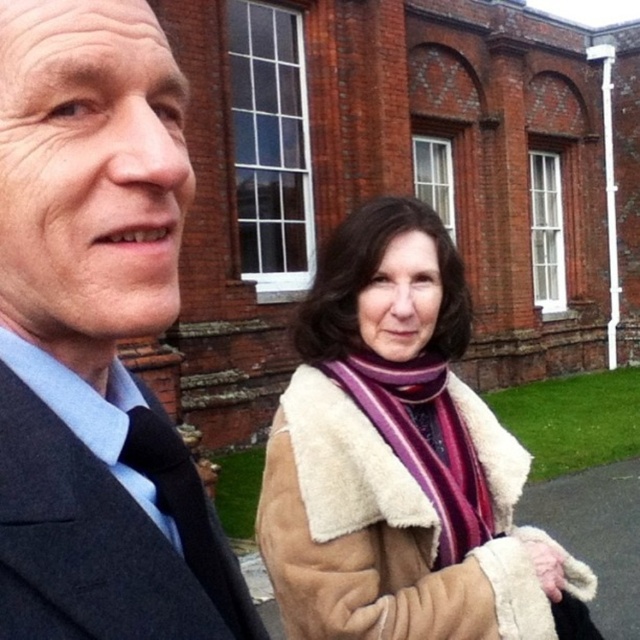
You are trying to determine which item is closer to the camera between the sheepskin coat at center and the purple striped scarf at center. Based on the scene, which one is closer?

The sheepskin coat at center is in front of the purple striped scarf at center, so it is closer to the camera.

You are a fashion designer observing the two outfits in the image. The dark blue woolen suit at left and the purple striped scarf at center. Which outfit is taller?

The dark blue woolen suit at left is taller than the purple striped scarf at center.

You are a photographer trying to capture a group photo of the dark gray suit at left and the sheepskin coat at center. The minimum distance your camera can focus on two subjects clearly is 5 meters. Can you take a photo of both subjects clearly from your current position?

The distance between the dark gray suit at left and the sheepskin coat at center is 5.51 meters, which exceeds the camera minimum focus distance of 5 meters. Therefore, you can take a photo of both subjects clearly from your current position.